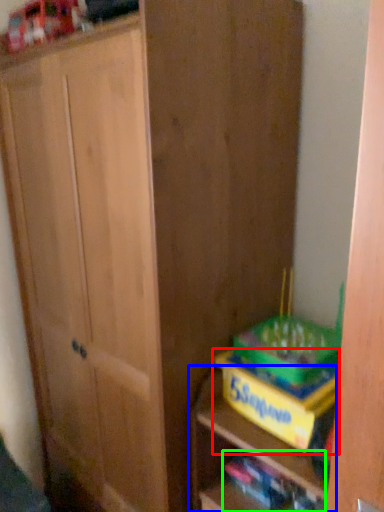
Question: Considering the real-world distances, which object is farthest from cabinetry (highlighted by a red box)? shelf (highlighted by a blue box) or book (highlighted by a green box)?

Choices:
 (A) shelf
 (B) book

Answer: (B)